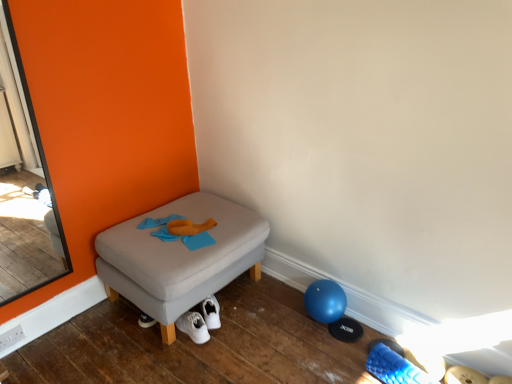
Question: Considering the positions of white fabric shoe at lower center and clear glass screen door at left in the image, is white fabric shoe at lower center bigger or smaller than clear glass screen door at left?

Choices:
 (A) small
 (B) big

Answer: (A)

Question: Looking at their shapes, would you say white fabric shoe at lower center is wider or thinner than clear glass screen door at left?

Choices:
 (A) thin
 (B) wide

Answer: (B)

Question: Which object is the closest to the clear glass screen door at left?

Choices:
 (A) matte gray ottoman at center
 (B) white fabric shoe at lower center

Answer: (A)

Question: Estimate the real-world distances between objects in this image. Which object is farther from the white fabric shoe at lower center?

Choices:
 (A) matte gray ottoman at center
 (B) clear glass screen door at left

Answer: (B)